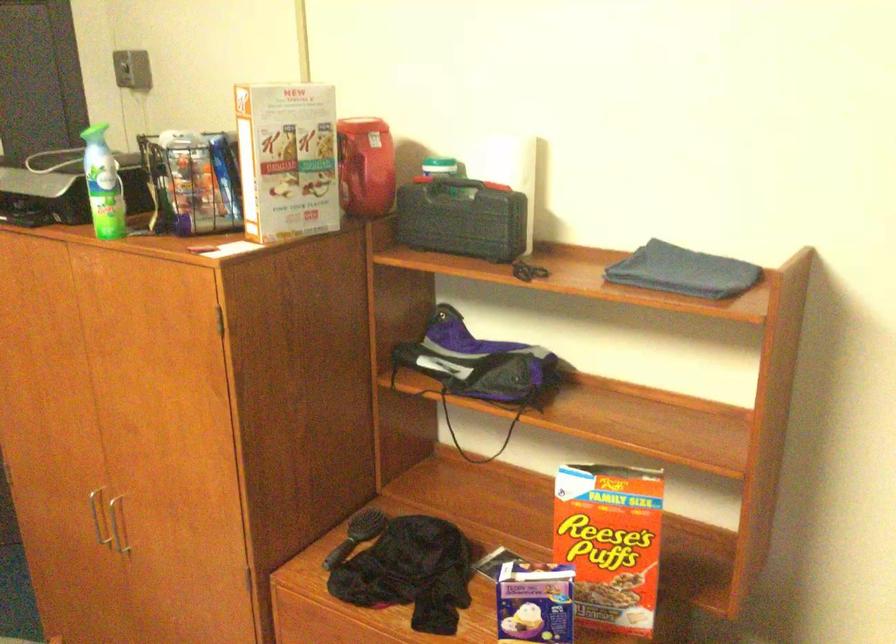
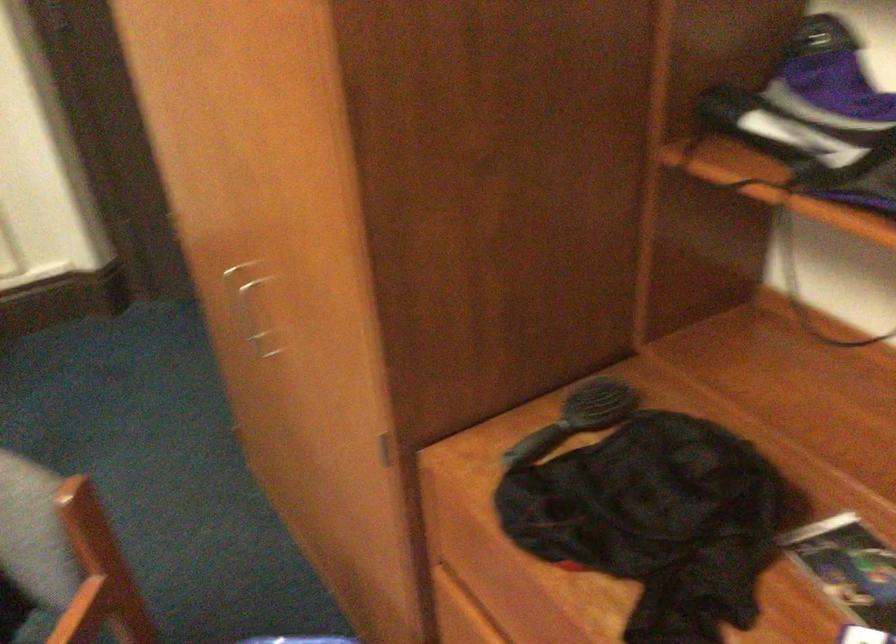
The images are taken continuously from a first-person perspective. In which direction is your viewpoint rotating?

The camera rotated toward left-down.